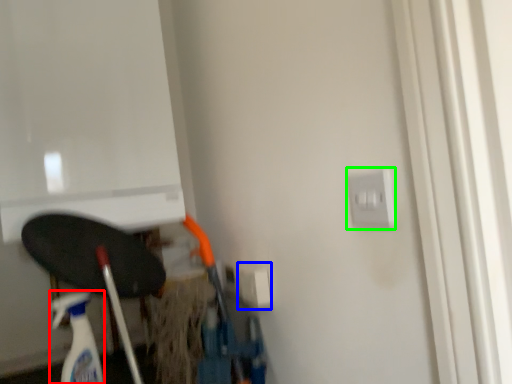
Question: Considering the real-world distances, which object is closest to cleaning product (highlighted by a red box)? electric outlet (highlighted by a blue box) or electric outlet (highlighted by a green box).

Choices:
 (A) electric outlet
 (B) electric outlet

Answer: (A)